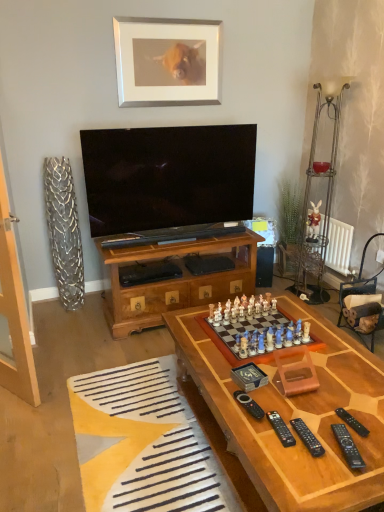
I want to click on free space to the left of black plastic remote at lower right, the third remote in the left-to-right sequence, so click(263, 443).